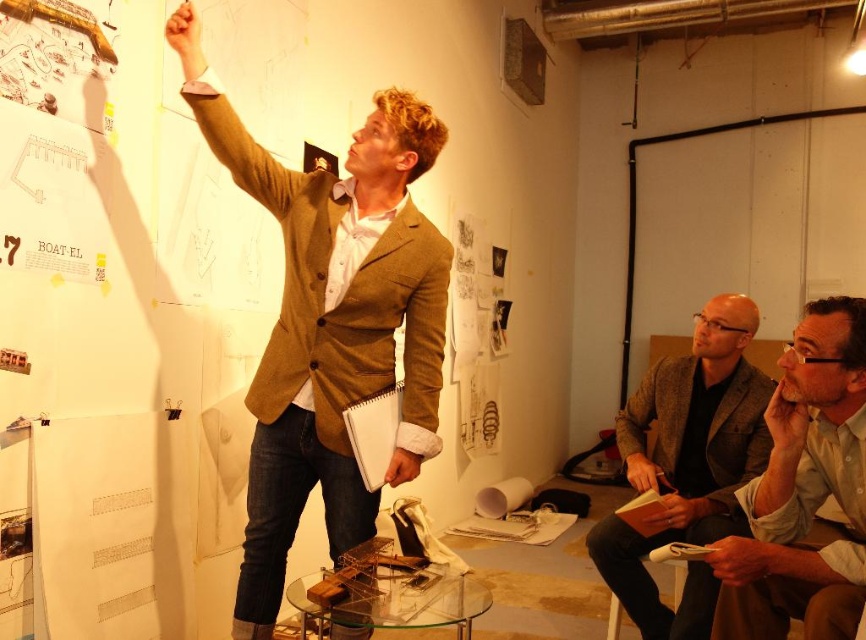
You are organizing a coat rack in the workshop and need to hang both the light brown leather jacket at lower right and the brown woolen blazer at lower right. Given their widths, which one should you place on the narrower hanger?

The light brown leather jacket at lower right has a lesser width compared to the brown woolen blazer at lower right, so it should be placed on the narrower hanger.

Based on the scene, can you determine if the brown textured blazer at upper center is wider than the white plastic stool at lower right?

The brown textured blazer at upper center is wider than the white plastic stool at lower right according to the description.

You are a photographer in the studio and want to take a picture of the white plastic stool at lower right without the brown woolen blazer at lower right appearing in the frame. Is this possible?

The brown woolen blazer at lower right is positioned over the white plastic stool at lower right, so it would block the stool entirely. Therefore, it is not possible to take a photo of the white plastic stool at lower right without the brown woolen blazer at lower right appearing in the frame.